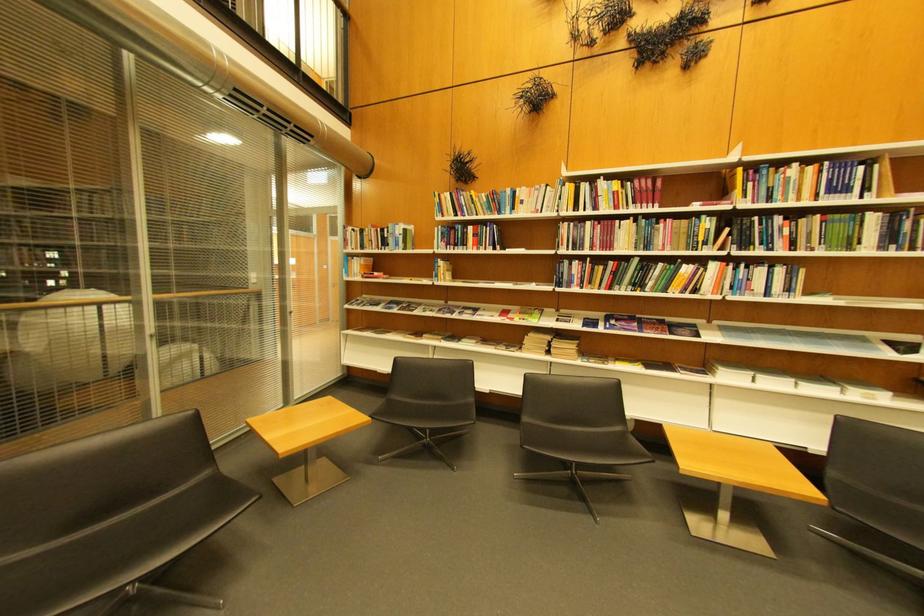
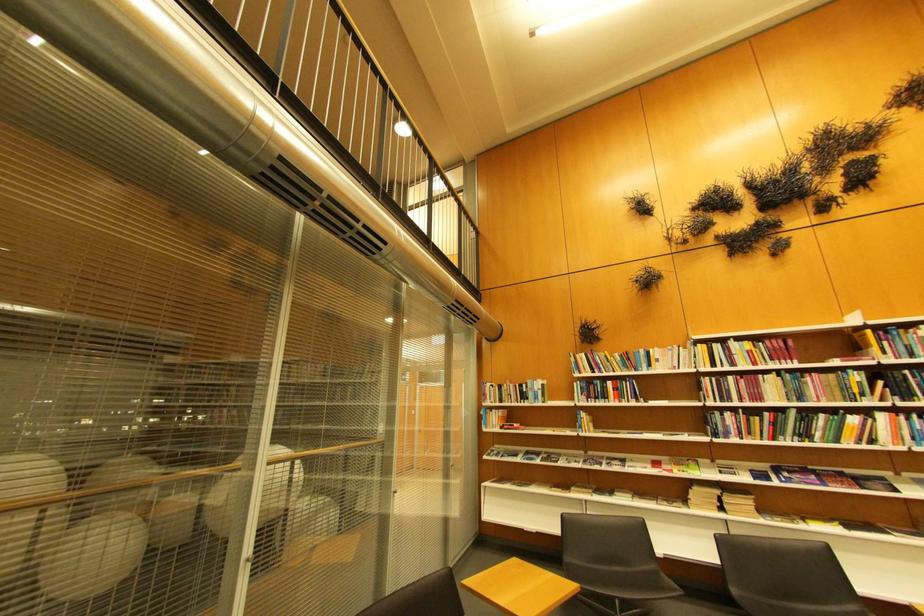
Where in the second image is the point corresponding to [675,292] from the first image?

(847, 443)